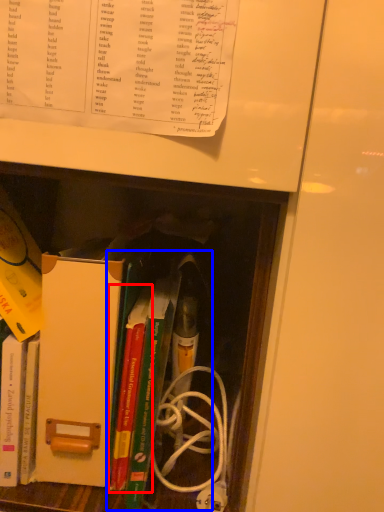
Question: Which of the following is the farthest to the observer, book (highlighted by a red box) or book (highlighted by a blue box)?

Choices:
 (A) book
 (B) book

Answer: (A)